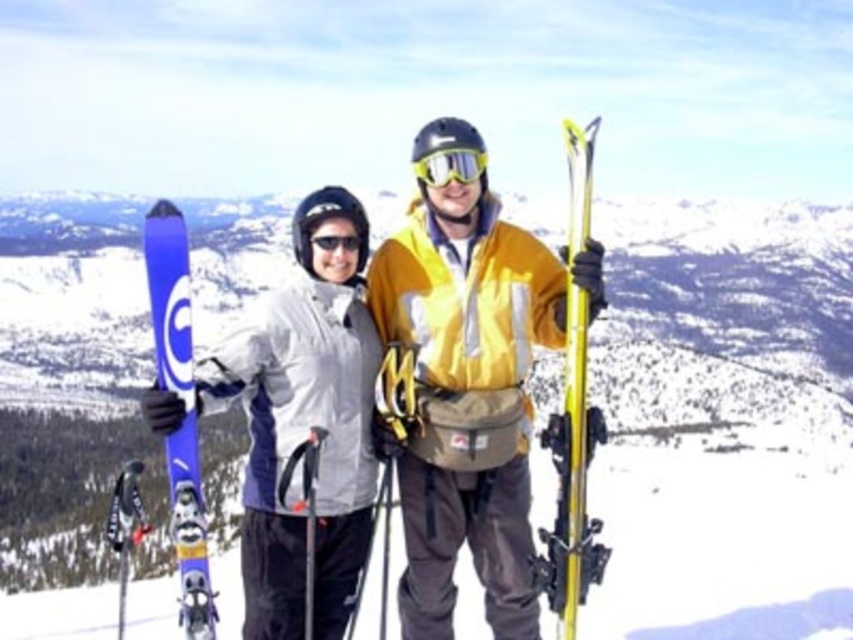
Question: Can you confirm if yellow metallic ski at right is positioned to the right of glossy plastic goggles at center?

Choices:
 (A) yes
 (B) no

Answer: (A)

Question: Can you confirm if matte blue snowboard at left is wider than yellow metallic ski at right?

Choices:
 (A) yes
 (B) no

Answer: (A)

Question: Among these objects, which one is farthest from the camera?

Choices:
 (A) blue matte skis at left
 (B) glossy plastic goggles at center
 (C) yellow metallic ski at right
 (D) matte blue skis at center

Answer: (B)

Question: Estimate the real-world distances between objects in this image. Which object is closer to the yellow metallic ski at right?

Choices:
 (A) glossy plastic goggles at center
 (B) matte blue snowboard at left
 (C) blue matte skis at left

Answer: (A)

Question: Estimate the real-world distances between objects in this image. Which object is closer to the matte blue snowboard at left?

Choices:
 (A) matte blue skis at center
 (B) glossy plastic goggles at center

Answer: (A)

Question: Is matte blue skis at center above glossy plastic goggles at center?

Choices:
 (A) no
 (B) yes

Answer: (A)